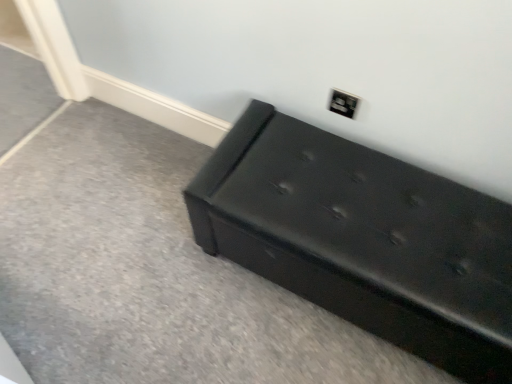
Question: From the image's perspective, is black leather bench at lower right above or below matte black outlet at upper right?

Choices:
 (A) below
 (B) above

Answer: (A)

Question: Looking at their shapes, would you say black leather bench at lower right is wider or thinner than matte black outlet at upper right?

Choices:
 (A) wide
 (B) thin

Answer: (A)

Question: In the image, is black leather bench at lower right on the left side or the right side of matte black outlet at upper right?

Choices:
 (A) left
 (B) right

Answer: (B)

Question: Is matte black outlet at upper right in front of or behind black leather bench at lower right in the image?

Choices:
 (A) behind
 (B) front

Answer: (A)

Question: Is matte black outlet at upper right wider or thinner than black leather bench at lower right?

Choices:
 (A) thin
 (B) wide

Answer: (A)

Question: From the image's perspective, is matte black outlet at upper right located above or below black leather bench at lower right?

Choices:
 (A) below
 (B) above

Answer: (B)

Question: From a real-world perspective, relative to black leather bench at lower right, is matte black outlet at upper right vertically above or below?

Choices:
 (A) below
 (B) above

Answer: (B)